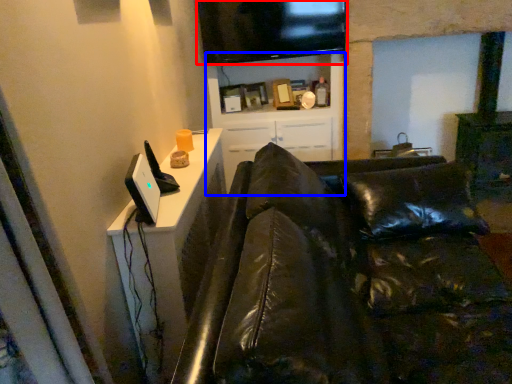
Question: Which point is further to the camera, television (highlighted by a red box) or entertainment center (highlighted by a blue box)?

Choices:
 (A) television
 (B) entertainment center

Answer: (B)